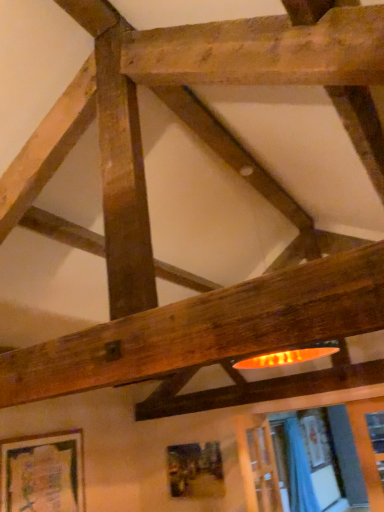
Question: Does point (294, 436) appear closer or farther from the camera than point (4, 463)?

Choices:
 (A) farther
 (B) closer

Answer: (A)

Question: From a real-world perspective, is blue fabric curtain at lower right physically located above or below wooden frame at lower left, acting as the 1th picture frame starting from the left?

Choices:
 (A) below
 (B) above

Answer: (A)

Question: Which of these objects is positioned farthest from the wooden textured picture frame at lower center, which is the 1th picture frame from back to front?

Choices:
 (A) blue fabric curtain at lower right
 (B) wooden frame at lower left, placed as the second picture frame when sorted from right to left

Answer: (B)

Question: Which of these objects is positioned farthest from the blue fabric curtain at lower right?

Choices:
 (A) wooden frame at lower left, acting as the 1th picture frame starting from the left
 (B) wooden textured picture frame at lower center, arranged as the 2th picture frame when viewed from the front

Answer: (A)